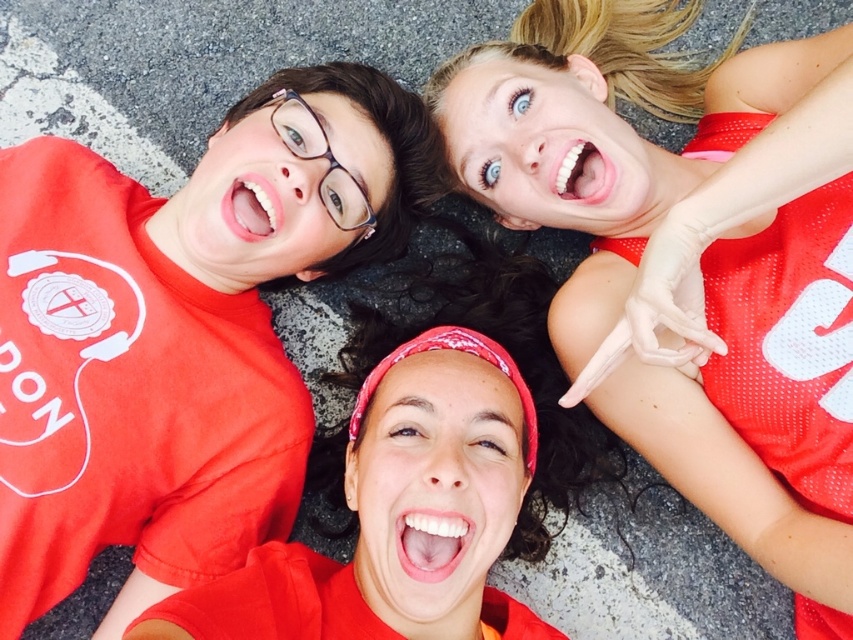
Does matte red t-shirt at upper left lie behind matte red jersey at upper right?

That is True.

Can you confirm if matte red t-shirt at upper left is taller than matte red jersey at upper right?

No.

At what (x,y) coordinates should I click in order to perform the action: click on matte red t-shirt at upper left. Please return your answer as a coordinate pair (x, y). The width and height of the screenshot is (853, 640). Looking at the image, I should click on (178, 332).